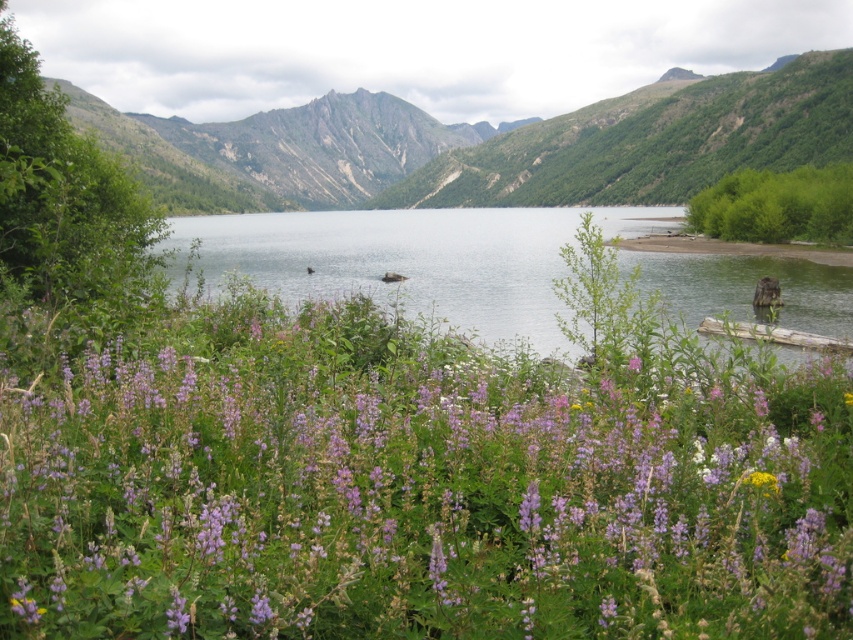
Question: Which point is farther from the camera taking this photo?

Choices:
 (A) (283, 449)
 (B) (299, 236)

Answer: (B)

Question: Which point is closer to the camera?

Choices:
 (A) pyautogui.click(x=740, y=570)
 (B) pyautogui.click(x=804, y=93)

Answer: (A)

Question: Can you confirm if green rock mountain at center is positioned to the left of clear water at center?

Choices:
 (A) yes
 (B) no

Answer: (A)

Question: Is purple soft-textured flowers at center above clear water at center?

Choices:
 (A) no
 (B) yes

Answer: (A)

Question: Does green rock mountain at center lie behind clear water at center?

Choices:
 (A) no
 (B) yes

Answer: (B)

Question: Among these objects, which one is nearest to the camera?

Choices:
 (A) green rock mountain at center
 (B) purple soft-textured flowers at center
 (C) clear water at center

Answer: (B)